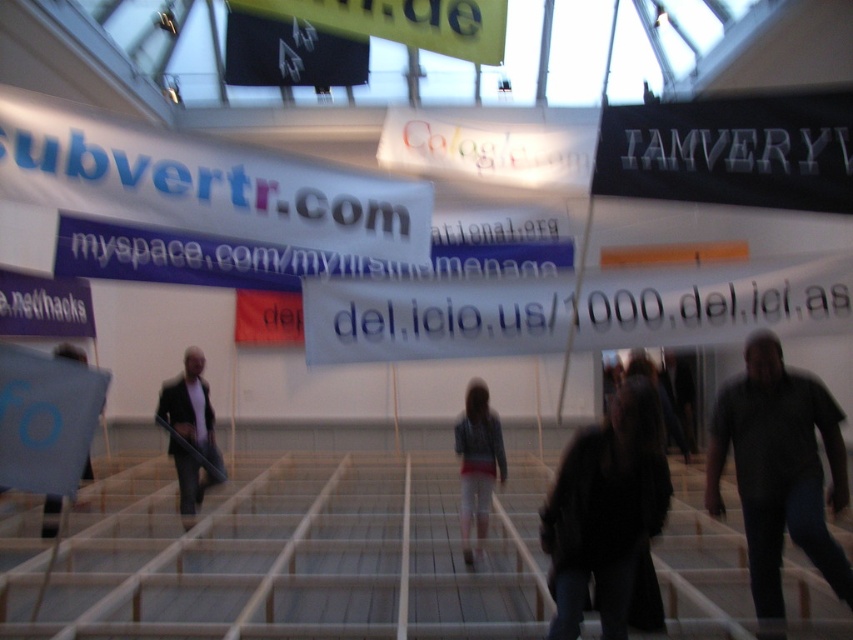
Question: Which object appears closest to the camera in this image?

Choices:
 (A) black paper at left
 (B) white glossy banner at center
 (C) dark gray suit at center
 (D) black matte sign at upper right

Answer: (D)

Question: Is white paper banner at upper left to the left of black matte flag at upper center from the viewer's perspective?

Choices:
 (A) no
 (B) yes

Answer: (A)

Question: Can you confirm if black fuzzy coat at lower right is wider than blue fabric bag at lower left?

Choices:
 (A) no
 (B) yes

Answer: (A)

Question: Is white paper banner at upper left wider than yellow fabric banner at upper center?

Choices:
 (A) no
 (B) yes

Answer: (B)

Question: Which object is farther from the camera taking this photo?

Choices:
 (A) white paper banner at upper left
 (B) black matte sign at upper right
 (C) white paper banner at center
 (D) yellow fabric banner at upper center

Answer: (D)

Question: Considering the real-world distances, which object is farthest from the denim jacket at center?

Choices:
 (A) black paper at left
 (B) dark gray suit at center

Answer: (A)